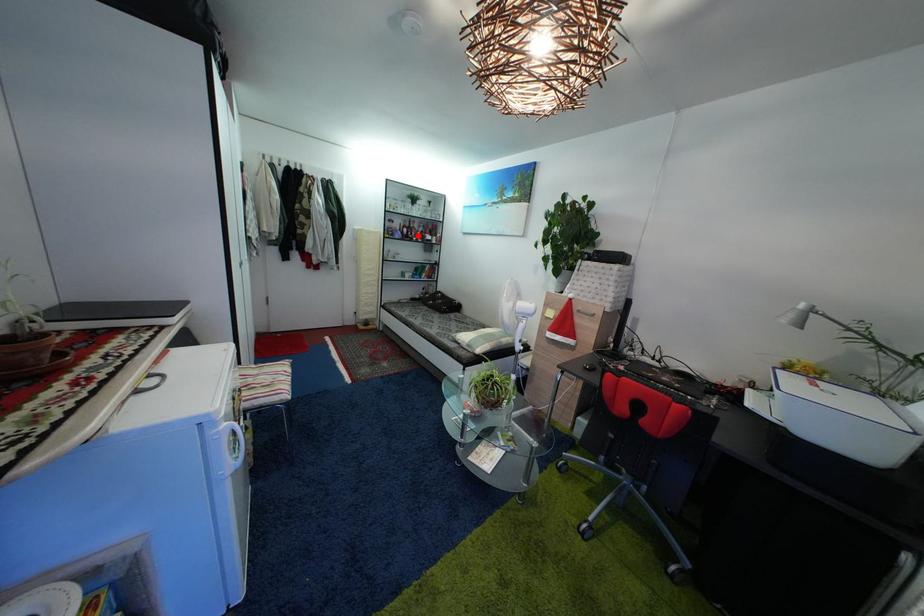
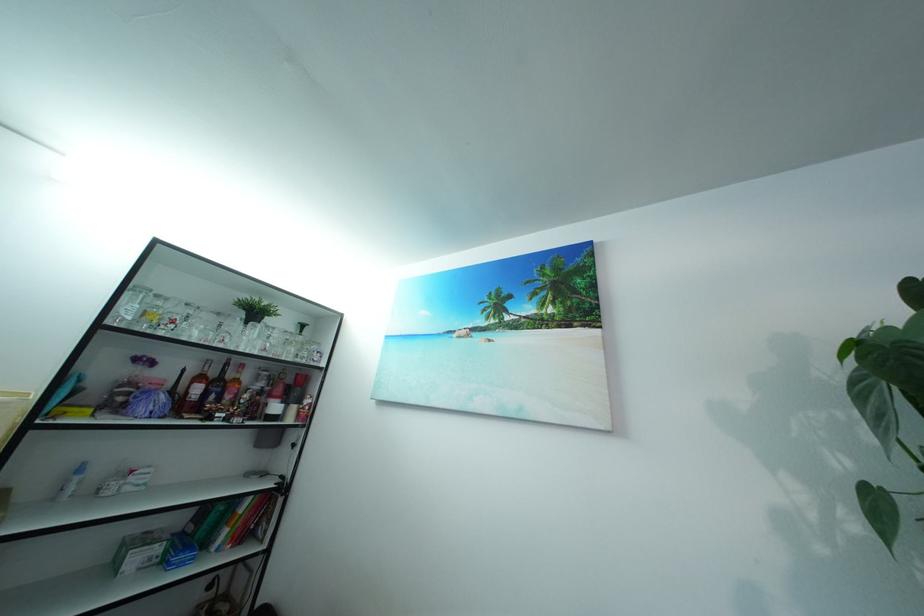
Question: A red point is marked in image1. In image2, is the corresponding 3D point closer to the camera or farther? Reply with the corresponding letter.

Choices:
 (A) The corresponding 3D point is closer.
 (B) The corresponding 3D point is farther.

Answer: (B)